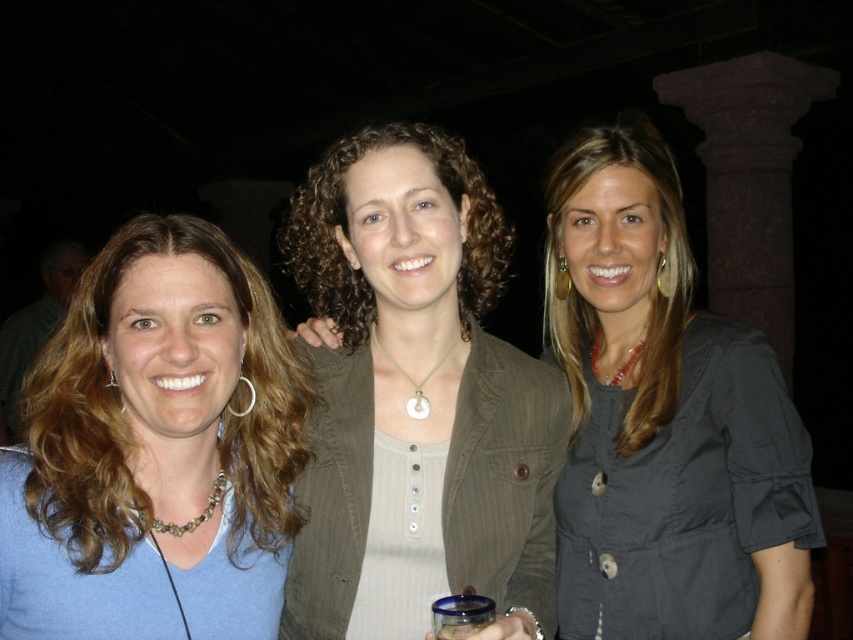
Question: Among these objects, which one is nearest to the camera?

Choices:
 (A) blue fabric shirt at left
 (B) matte olive green blazer at center
 (C) matte black blouse at right

Answer: (B)

Question: Can you confirm if matte olive green blazer at center is thinner than matte black blouse at right?

Choices:
 (A) no
 (B) yes

Answer: (A)

Question: Among these points, which one is nearest to the camera?

Choices:
 (A) (192, 435)
 (B) (747, 328)

Answer: (A)

Question: From the image, what is the correct spatial relationship of matte olive green blazer at center in relation to matte black blouse at right?

Choices:
 (A) right
 (B) left

Answer: (B)

Question: Estimate the real-world distances between objects in this image. Which object is closer to the blue fabric shirt at left?

Choices:
 (A) matte black blouse at right
 (B) matte olive green blazer at center

Answer: (B)

Question: Does matte olive green blazer at center have a lesser width compared to blue fabric shirt at left?

Choices:
 (A) yes
 (B) no

Answer: (B)